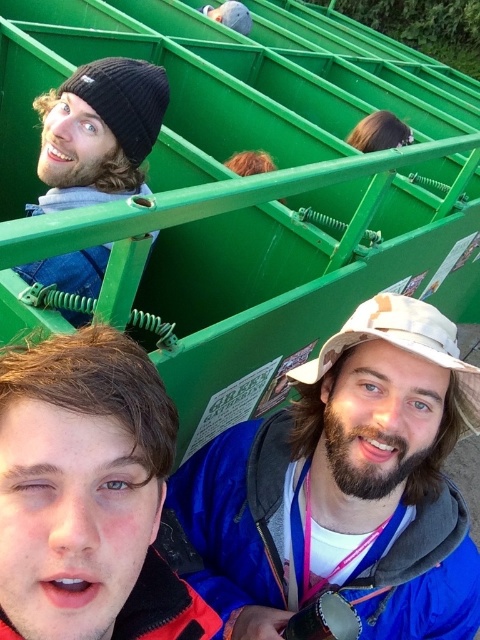
You are a photographer trying to capture a clear shot of both the beige fabric hat at center and the matte blue jacket at lower left. Since you want to ensure both are fully visible in the frame, which object should you focus on first to account for their sizes?

The beige fabric hat at center is much taller than the matte blue jacket at lower left, so you should focus on the beige fabric hat at center first to ensure it fits within the frame.

You are a photographer standing at the back of the green metal structure. You want to take a photo that includes both the beige fabric hat at center and the black knit beanie at upper left. Given that your camera has a maximum focus range of 25 inches, will you be able to capture both objects clearly in the same frame?

The beige fabric hat at center and the black knit beanie at upper left are 26.30 inches apart, which exceeds the camera maximum focus range of 25 inches. Therefore, you cannot capture both objects clearly in the same frame.

Looking at this image, you are trying to decide which hat to wear for a casual day out. Both the beige fabric hat at center and the white fabric baseball hat at center are options. Based on their sizes, which hat has a wider brim?

The beige fabric hat at center has a wider brim than the white fabric baseball hat at center according to the description.